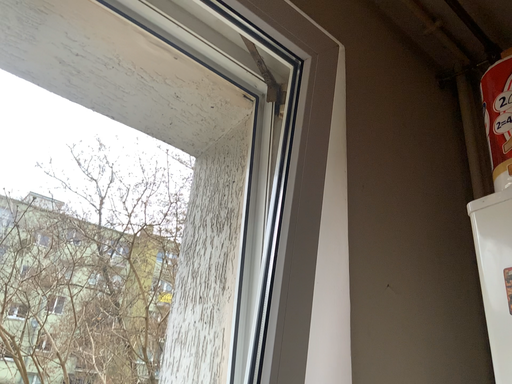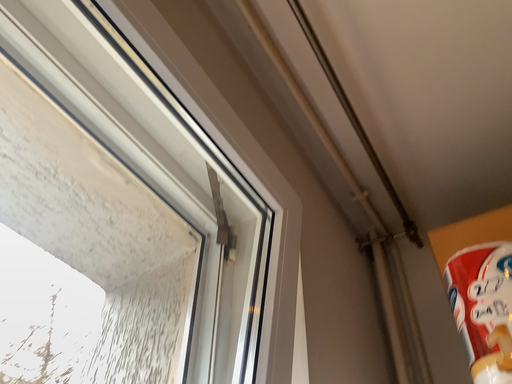
Question: Which way did the camera rotate in the video?

Choices:
 (A) rotated left
 (B) rotated right

Answer: (B)